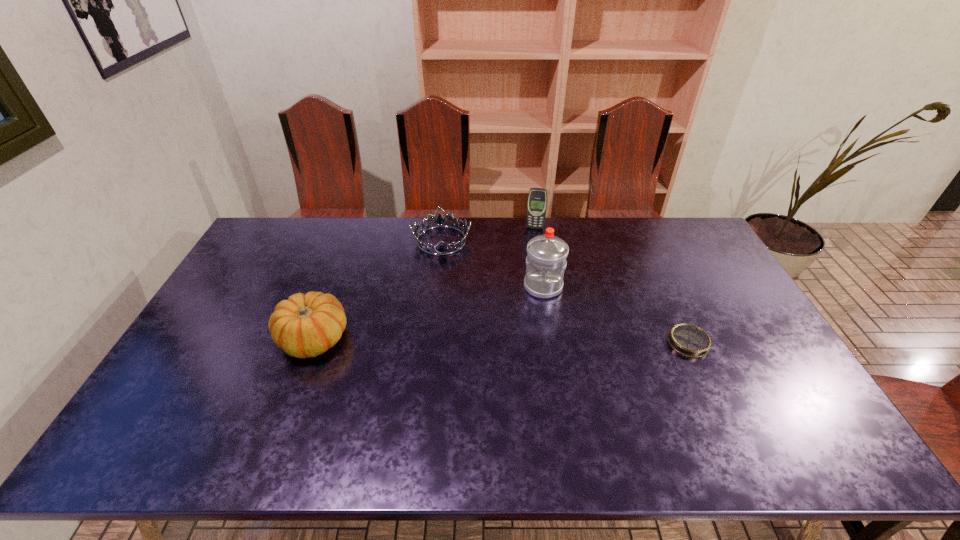
The width and height of the screenshot is (960, 540). Identify the location of gourd. coord(306,325).

Where is `the third tallest object`? This screenshot has width=960, height=540. the third tallest object is located at coordinates coord(306,325).

At what (x,y) coordinates should I click in order to perform the action: click on the shortest object. Please return your answer as a coordinate pair (x, y). This screenshot has height=540, width=960. Looking at the image, I should click on (689, 340).

Where is `the rightmost object`? The height and width of the screenshot is (540, 960). the rightmost object is located at coordinates (689, 340).

This screenshot has height=540, width=960. Find the location of `cellular telephone`. cellular telephone is located at coordinates (537, 199).

Where is `the third farthest object`? Image resolution: width=960 pixels, height=540 pixels. the third farthest object is located at coordinates (546, 260).

In order to click on the tallest object in this screenshot , I will do `click(546, 260)`.

Identify the location of tiara. (439, 221).

The width and height of the screenshot is (960, 540). Identify the location of the fourth object from right to left. click(x=439, y=221).

Where is `vacant space positioned on the left of the gourd`? This screenshot has width=960, height=540. vacant space positioned on the left of the gourd is located at coordinates (229, 339).